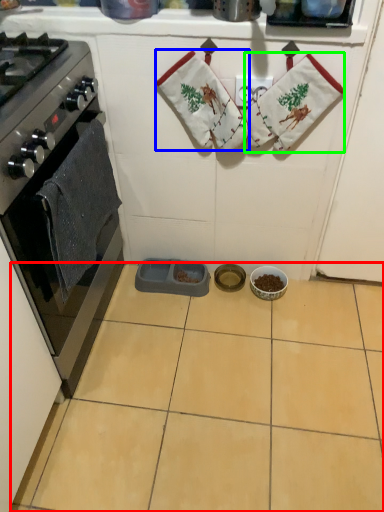
Question: Which object is positioned farthest from ceramic tile (highlighted by a red box)? Select from hand towel (highlighted by a blue box) and material (highlighted by a green box).

Choices:
 (A) hand towel
 (B) material

Answer: (B)